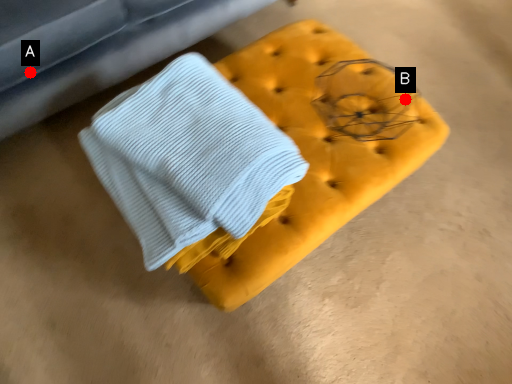
Question: Two points are circled on the image, labeled by A and B beside each circle. Which point appears closest to the camera in this image?

Choices:
 (A) A is closer
 (B) B is closer

Answer: (B)